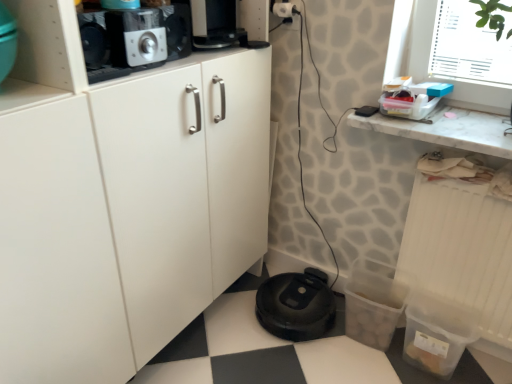
Where is `free space to the left of black plastic robot vacuum cleaner at lower center`? The image size is (512, 384). free space to the left of black plastic robot vacuum cleaner at lower center is located at coordinates (225, 325).